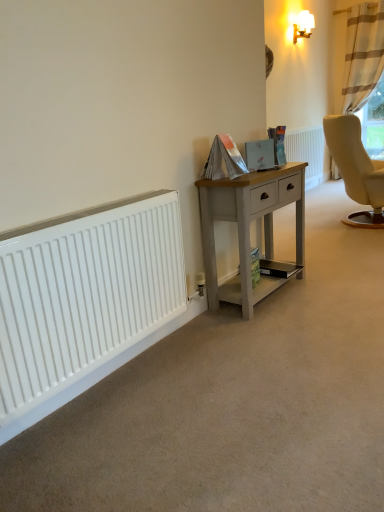
Locate an element on the screen. beige striped curtain at upper right is located at coordinates (363, 54).

The image size is (384, 512). Describe the element at coordinates (307, 153) in the screenshot. I see `white textured radiator at center, acting as the 2th radiator starting from the bottom` at that location.

Find the location of a particular element. The width and height of the screenshot is (384, 512). light gray wood desk at center is located at coordinates (249, 230).

Identify the location of beige striped curtain at upper right. (363, 54).

Which is closer, (309,170) or (376,20)?

Point (376,20)

Can you tell me how much white textured radiator at center, the second radiator viewed from the left, and beige striped curtain at upper right differ in facing direction?

The angular difference between white textured radiator at center, the second radiator viewed from the left, and beige striped curtain at upper right is 88.9 degrees.

Considering their positions, is white textured radiator at center, the 1th radiator from the back, located in front of or behind beige striped curtain at upper right?

white textured radiator at center, the 1th radiator from the back, is positioned closer to the viewer than beige striped curtain at upper right.

Is white textured radiator at center, placed as the second radiator when sorted from front to back, smaller than beige striped curtain at upper right?

Yes.

Measure the distance between beige striped curtain at upper right and white smooth radiator at lower left, which is the second radiator from top to bottom.

beige striped curtain at upper right and white smooth radiator at lower left, which is the second radiator from top to bottom, are 4.67 meters apart.

Can you confirm if beige striped curtain at upper right is positioned to the left of white smooth radiator at lower left, the second radiator positioned from the right?

No, beige striped curtain at upper right is not to the left of white smooth radiator at lower left, the second radiator positioned from the right.

The width and height of the screenshot is (384, 512). Identify the location of curtain on the right of white smooth radiator at lower left, the second radiator positioned from the right. (363, 54).

Looking at their sizes, would you say beige striped curtain at upper right is wider or thinner than white smooth radiator at lower left, which is the second radiator from top to bottom?

Considering their sizes, beige striped curtain at upper right looks broader than white smooth radiator at lower left, which is the second radiator from top to bottom.

Is white smooth radiator at lower left, the first radiator in the left-to-right sequence, taller or shorter than white textured radiator at center, the 1th radiator positioned from the right?

white smooth radiator at lower left, the first radiator in the left-to-right sequence, is shorter than white textured radiator at center, the 1th radiator positioned from the right.

In terms of width, does white smooth radiator at lower left, the 1th radiator from the front, look wider or thinner when compared to white textured radiator at center, which ranks as the first radiator in top-to-bottom order?

white smooth radiator at lower left, the 1th radiator from the front, is thinner than white textured radiator at center, which ranks as the first radiator in top-to-bottom order.

Which object is closer to the camera, white smooth radiator at lower left, the second radiator positioned from the right, or white textured radiator at center, placed as the second radiator when sorted from front to back?

white smooth radiator at lower left, the second radiator positioned from the right, is closer to the camera.

Would you say white smooth radiator at lower left, which is the second radiator from top to bottom, is to the left or to the right of white textured radiator at center, the 1th radiator positioned from the right, in the picture?

white smooth radiator at lower left, which is the second radiator from top to bottom, is positioned on white textured radiator at center, the 1th radiator positioned from the right,'s left side.

How many degrees apart are the facing directions of white glossy wall lamp at upper right and light gray wood desk at center?

There is a 0.255-degree angle between the facing directions of white glossy wall lamp at upper right and light gray wood desk at center.

Is point (307, 13) closer or farther from the camera than point (291, 187)?

Point (307, 13).

Can you confirm if white glossy wall lamp at upper right is bigger than light gray wood desk at center?

Actually, white glossy wall lamp at upper right might be smaller than light gray wood desk at center.

Is white glossy wall lamp at upper right spatially inside light gray wood desk at center, or outside of it?

white glossy wall lamp at upper right is outside light gray wood desk at center.

Is white glossy wall lamp at upper right turned away from white smooth radiator at lower left, positioned as the first radiator in bottom-to-top order?

No, white glossy wall lamp at upper right's orientation is not away from white smooth radiator at lower left, positioned as the first radiator in bottom-to-top order.

Is white glossy wall lamp at upper right next to white smooth radiator at lower left, which is the second radiator from top to bottom, and touching it?

No, white glossy wall lamp at upper right is not next to white smooth radiator at lower left, which is the second radiator from top to bottom.

Consider the image. Can you confirm if white glossy wall lamp at upper right is thinner than white smooth radiator at lower left, positioned as the second radiator in back-to-front order?

Incorrect, the width of white glossy wall lamp at upper right is not less than that of white smooth radiator at lower left, positioned as the second radiator in back-to-front order.

From a real-world perspective, relative to white smooth radiator at lower left, the first radiator in the left-to-right sequence, is white glossy wall lamp at upper right vertically above or below?

Clearly, from a real-world perspective, white glossy wall lamp at upper right is above white smooth radiator at lower left, the first radiator in the left-to-right sequence.

Is beige striped curtain at upper right to the left of light gray wood desk at center from the viewer's perspective?

No.

Is beige striped curtain at upper right facing towards light gray wood desk at center?

Yes, beige striped curtain at upper right is oriented towards light gray wood desk at center.

Based on the photo, based on their sizes in the image, would you say beige striped curtain at upper right is bigger or smaller than light gray wood desk at center?

beige striped curtain at upper right is bigger than light gray wood desk at center.

How much distance is there between beige striped curtain at upper right and light gray wood desk at center?

beige striped curtain at upper right and light gray wood desk at center are 11.52 feet apart from each other.

Who is smaller, light gray wood desk at center or white glossy wall lamp at upper right?

With smaller size is white glossy wall lamp at upper right.

Is light gray wood desk at center facing towards white glossy wall lamp at upper right?

No, light gray wood desk at center is not aimed at white glossy wall lamp at upper right.

From the image's perspective, between light gray wood desk at center and white glossy wall lamp at upper right, who is located below?

light gray wood desk at center.

Locate an element on the screen. curtain on the right of white textured radiator at center, placed as the second radiator when sorted from front to back is located at coordinates (363, 54).

The image size is (384, 512). Identify the location of the 2nd radiator in front of the beige striped curtain at upper right. (84, 293).

Which object lies nearer to the anchor point white smooth radiator at lower left, the second radiator positioned from the right, white textured radiator at center, the 1th radiator from the back, or light gray wood desk at center?

Based on the image, light gray wood desk at center appears to be nearer to white smooth radiator at lower left, the second radiator positioned from the right.

Considering their positions, is white smooth radiator at lower left, which is the second radiator from top to bottom, positioned further to white textured radiator at center, which ranks as the first radiator in top-to-bottom order, than beige striped curtain at upper right?

white smooth radiator at lower left, which is the second radiator from top to bottom, is positioned further to the anchor white textured radiator at center, which ranks as the first radiator in top-to-bottom order.

Looking at the image, which one is located further to light gray wood desk at center, beige striped curtain at upper right or white textured radiator at center, acting as the 2th radiator starting from the bottom?

beige striped curtain at upper right is further to light gray wood desk at center.

Looking at the image, which one is located closer to light gray wood desk at center, white textured radiator at center, the 1th radiator positioned from the right, or white smooth radiator at lower left, positioned as the first radiator in bottom-to-top order?

Based on the image, white smooth radiator at lower left, positioned as the first radiator in bottom-to-top order, appears to be nearer to light gray wood desk at center.

Based on their spatial positions, is white glossy wall lamp at upper right or beige striped curtain at upper right closer to light gray wood desk at center?

beige striped curtain at upper right lies closer to light gray wood desk at center than the other object.

From the image, which object appears to be nearer to light gray wood desk at center, beige striped curtain at upper right or white smooth radiator at lower left, which is the second radiator from top to bottom?

The object closer to light gray wood desk at center is white smooth radiator at lower left, which is the second radiator from top to bottom.

Which object lies further to the anchor point white smooth radiator at lower left, which is the second radiator from top to bottom, white glossy wall lamp at upper right or light gray wood desk at center?

white glossy wall lamp at upper right is further to white smooth radiator at lower left, which is the second radiator from top to bottom.

Estimate the real-world distances between objects in this image. Which object is closer to beige striped curtain at upper right, white glossy wall lamp at upper right or light gray wood desk at center?

white glossy wall lamp at upper right is positioned closer to the anchor beige striped curtain at upper right.

Locate an element on the screen. lamp between white smooth radiator at lower left, the 1th radiator from the front, and beige striped curtain at upper right from front to back is located at coordinates coord(303,25).

The height and width of the screenshot is (512, 384). I want to click on desk located between white smooth radiator at lower left, positioned as the second radiator in back-to-front order, and white textured radiator at center, which ranks as the first radiator in top-to-bottom order, in the depth direction, so click(x=249, y=230).

You are a GUI agent. You are given a task and a screenshot of the screen. Output one action in this format:
    pyautogui.click(x=<x>, y=<y>)
    Task: Click on the desk between white smooth radiator at lower left, positioned as the second radiator in back-to-front order, and white glossy wall lamp at upper right from front to back
    
    Given the screenshot: What is the action you would take?
    (249, 230)

Locate an element on the screen. The width and height of the screenshot is (384, 512). radiator between white smooth radiator at lower left, the first radiator in the left-to-right sequence, and beige striped curtain at upper right in the front-back direction is located at coordinates (307, 153).